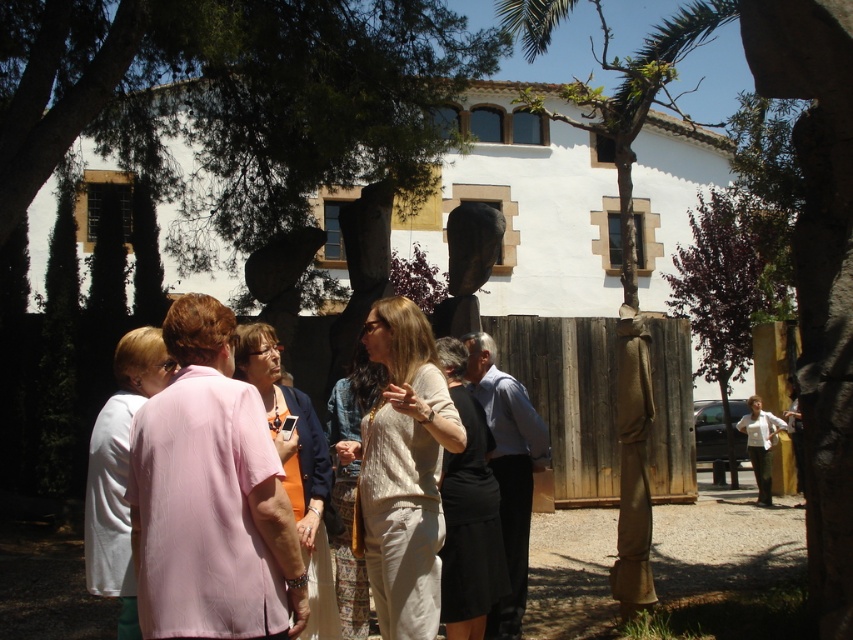
Question: Does brown wooden tree at center have a greater width compared to purple leafy tree at right?

Choices:
 (A) no
 (B) yes

Answer: (B)

Question: Does brown wooden tree at center have a smaller size compared to black stone sculpture at center?

Choices:
 (A) no
 (B) yes

Answer: (A)

Question: Which of the following is the closest to the observer?

Choices:
 (A) (711, 13)
 (B) (474, 246)

Answer: (B)

Question: Which of these objects is positioned closest to the brown wooden tree at center?

Choices:
 (A) purple leafy tree at right
 (B) black stone sculpture at center

Answer: (A)

Question: Considering the relative positions of brown wooden tree at center and black stone sculpture at center in the image provided, where is brown wooden tree at center located with respect to black stone sculpture at center?

Choices:
 (A) right
 (B) left

Answer: (A)

Question: Among these points, which one is farthest from the camera?

Choices:
 (A) (618, 122)
 (B) (685, 275)

Answer: (B)